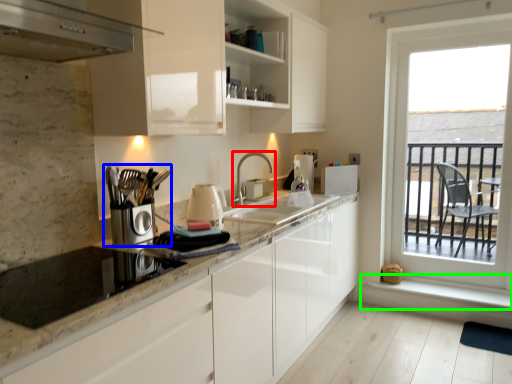
Question: Which object is the farthest from tap (highlighted by a red box)? Choose among these: coffee machine (highlighted by a blue box) or window sill (highlighted by a green box).

Choices:
 (A) coffee machine
 (B) window sill

Answer: (B)